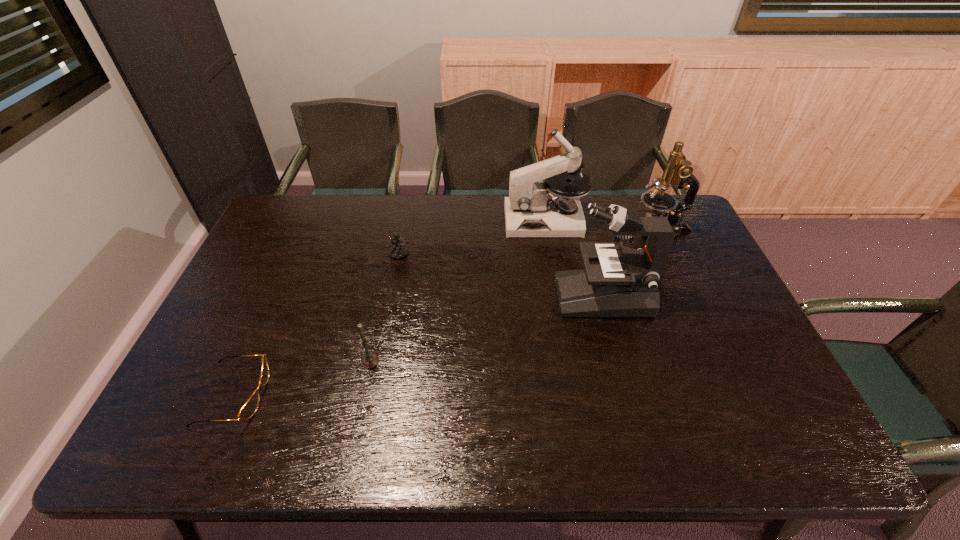
Image resolution: width=960 pixels, height=540 pixels. What are the coordinates of `free location located 0.200m at the eyepiece of the rightmost microscope` in the screenshot? It's located at (573, 230).

This screenshot has width=960, height=540. I want to click on vacant space situated at the eyepiece of the rightmost microscope, so tap(547, 230).

Image resolution: width=960 pixels, height=540 pixels. What are the coordinates of `free spot located at the eyepiece of the rightmost microscope` in the screenshot? It's located at (544, 230).

The height and width of the screenshot is (540, 960). Find the location of `blank area located on the back of the candle`. blank area located on the back of the candle is located at coordinates (386, 287).

Locate an element on the screen. The width and height of the screenshot is (960, 540). free space located 0.220m on the front of the pinecone is located at coordinates tap(387, 314).

Locate an element on the screen. The width and height of the screenshot is (960, 540). vacant space located on the front-facing side of the leftmost object is located at coordinates (348, 395).

Locate an element on the screen. The image size is (960, 540). object present at the near edge is located at coordinates (249, 408).

This screenshot has height=540, width=960. I want to click on object that is at the left edge, so click(249, 408).

Where is `object that is at the right edge`? The image size is (960, 540). object that is at the right edge is located at coordinates (678, 172).

You are a GUI agent. You are given a task and a screenshot of the screen. Output one action in this format:
    pyautogui.click(x=<x>, y=<y>)
    Task: Click on the object that is at the near left corner
    Image resolution: width=960 pixels, height=540 pixels.
    Given the screenshot: What is the action you would take?
    pyautogui.click(x=249, y=408)